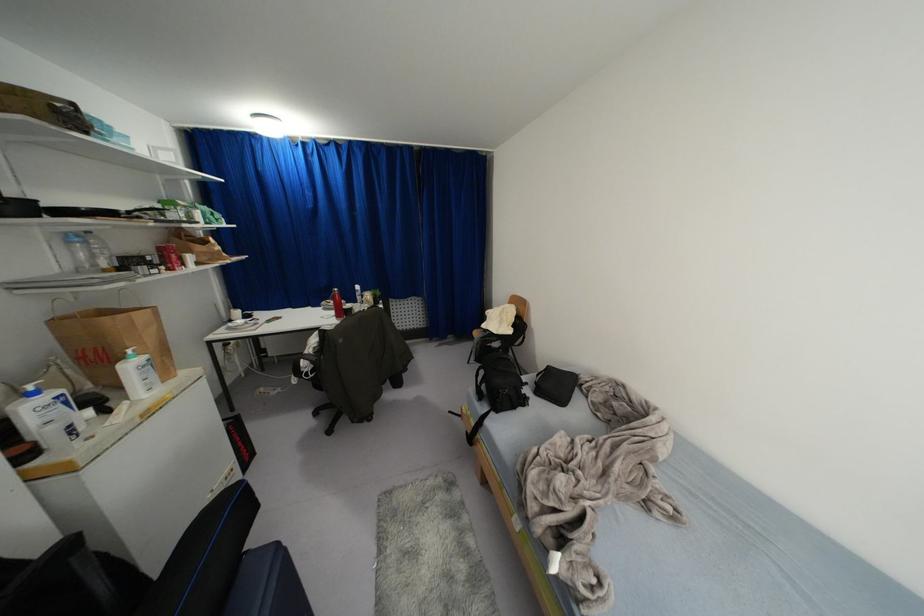
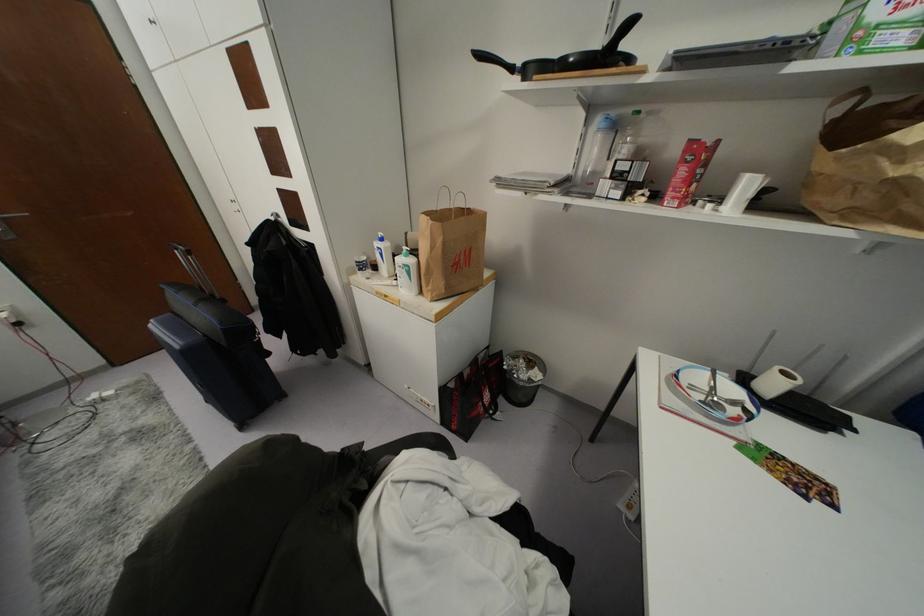
Find the pixel in the second image that matches pixel 65 402 in the first image.

(381, 254)